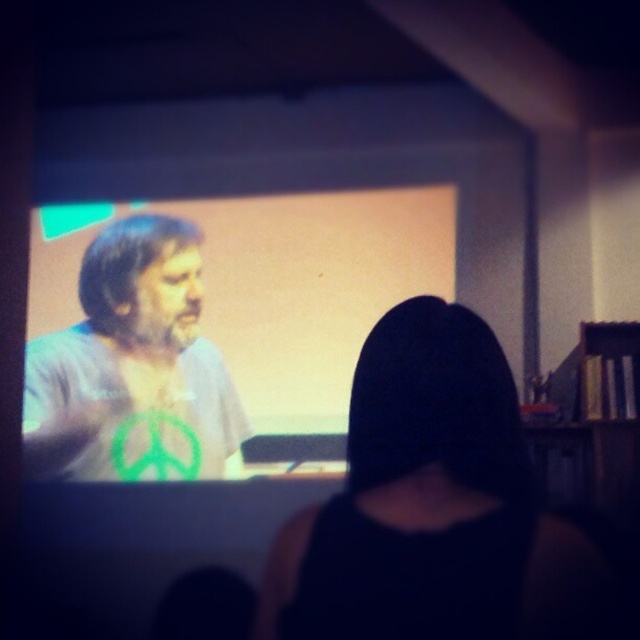
You are a photographer trying to capture a clear image of the black matte hair at center and the green fabric shirt at center in the dimly lit room. Based on their sizes, which object should you focus on first to ensure proper exposure?

The black matte hair at center has a lesser width compared to the green fabric shirt at center, so you should focus on the green fabric shirt at center first to ensure proper exposure since it is larger and will require more precise lighting adjustments.